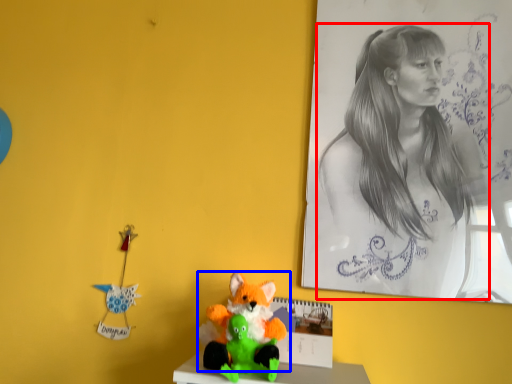
Question: Which object appears farthest to the camera in this image, woman (highlighted by a red box) or toy (highlighted by a blue box)?

Choices:
 (A) woman
 (B) toy

Answer: (A)